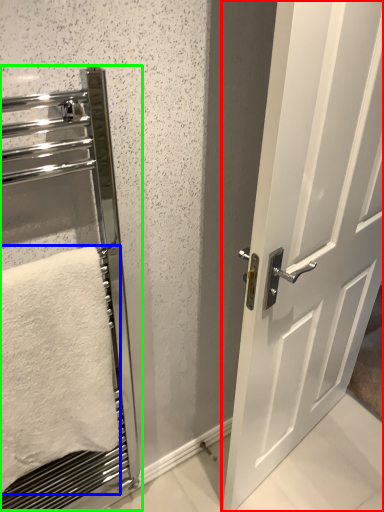
Question: Based on their relative distances, which object is farther from door (highlighted by a red box)? Choose from towel (highlighted by a blue box) and elevator (highlighted by a green box).

Choices:
 (A) towel
 (B) elevator

Answer: (B)